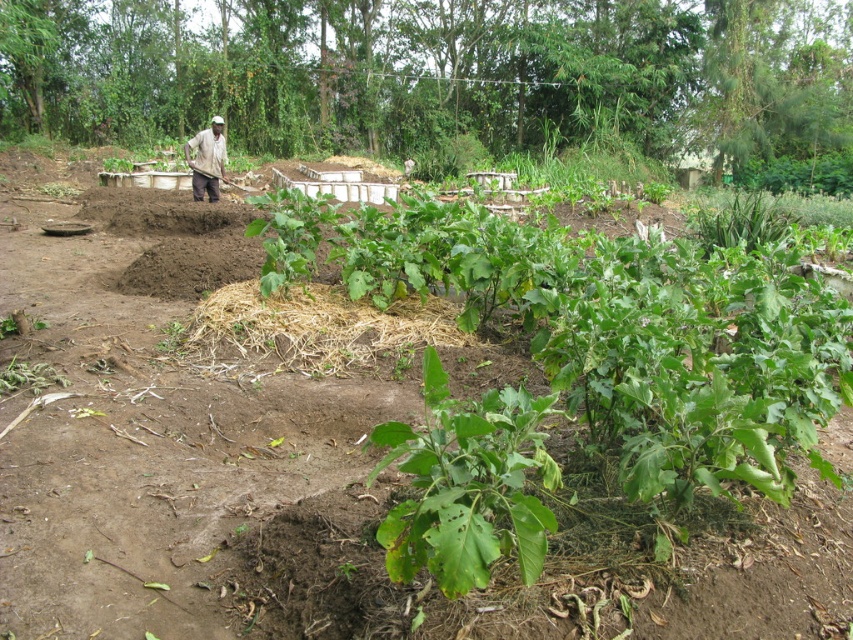
Question: Does green leafy plant at center appear under brown straw at center?

Choices:
 (A) no
 (B) yes

Answer: (B)

Question: Which point is closer to the camera taking this photo?

Choices:
 (A) click(340, 305)
 (B) click(479, 522)
 (C) click(216, 125)

Answer: (B)

Question: Which object is closer to the camera taking this photo?

Choices:
 (A) brown straw at center
 (B) green leafy plant at center

Answer: (B)

Question: Considering the real-world distances, which object is farthest from the brown straw at center?

Choices:
 (A) dark brown skin at center
 (B) green leafy plant at center

Answer: (A)

Question: Can you confirm if green leafy plant at center is smaller than dark brown skin at center?

Choices:
 (A) no
 (B) yes

Answer: (A)

Question: Does green leafy plant at center have a greater width compared to dark brown skin at center?

Choices:
 (A) no
 (B) yes

Answer: (B)